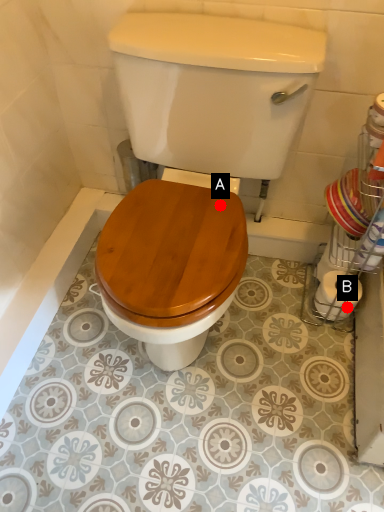
Question: Two points are circled on the image, labeled by A and B beside each circle. Which point is farther from the camera taking this photo?

Choices:
 (A) A is further
 (B) B is further

Answer: (B)